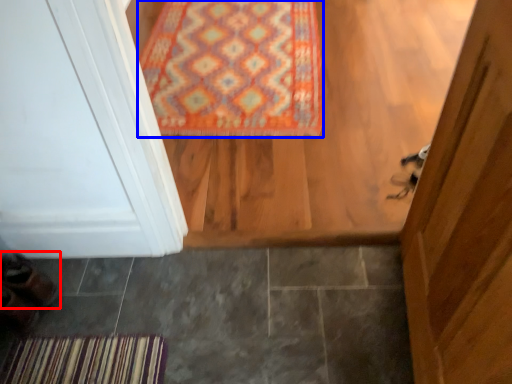
Question: Among these objects, which one is farthest to the camera, shoe (highlighted by a red box) or mat (highlighted by a blue box)?

Choices:
 (A) shoe
 (B) mat

Answer: (B)